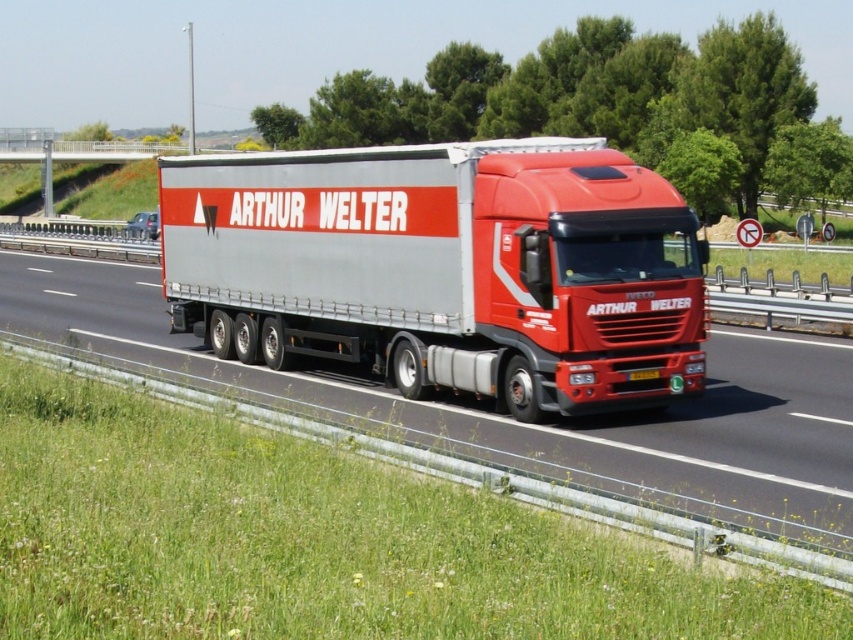
Question: Which of the following is the closest to the observer?

Choices:
 (A) (315, 220)
 (B) (845, 486)

Answer: (B)

Question: Which of the following is the farthest from the observer?

Choices:
 (A) metallic silver trailer truck at center
 (B) red matte truck at center

Answer: (A)

Question: Can you confirm if metallic silver trailer truck at center is positioned to the right of red matte truck at center?

Choices:
 (A) yes
 (B) no

Answer: (A)

Question: In this image, where is metallic silver trailer truck at center located relative to red matte truck at center?

Choices:
 (A) right
 (B) left

Answer: (A)

Question: Which object is closer to the camera taking this photo?

Choices:
 (A) red matte truck at center
 (B) metallic silver trailer truck at center

Answer: (A)

Question: In this image, where is metallic silver trailer truck at center located relative to red matte truck at center?

Choices:
 (A) right
 (B) left

Answer: (A)